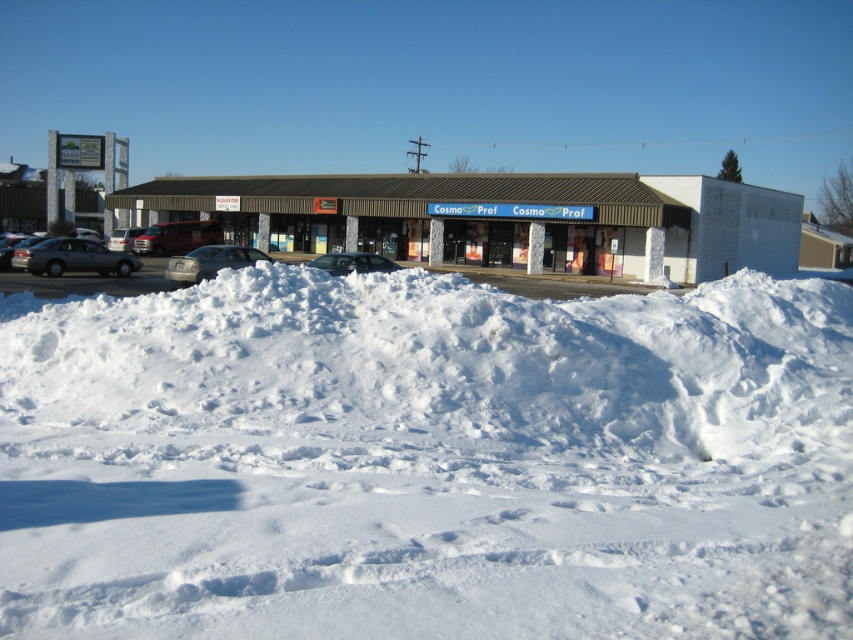
You are a delivery person trying to park your silver metallic van at left in the parking lot near the commercial building. There is a large pile of white fluffy snow at lower center blocking the entrance. Can you drive around it to the right side?

The white fluffy snow at lower center is to the right of the silver metallic van at left. Since the snow is positioned to the right of the van, driving around it to the right side would be possible as long as there is enough space. However, the description does not specify the exact dimensions or clearance needed, so proceed with caution.